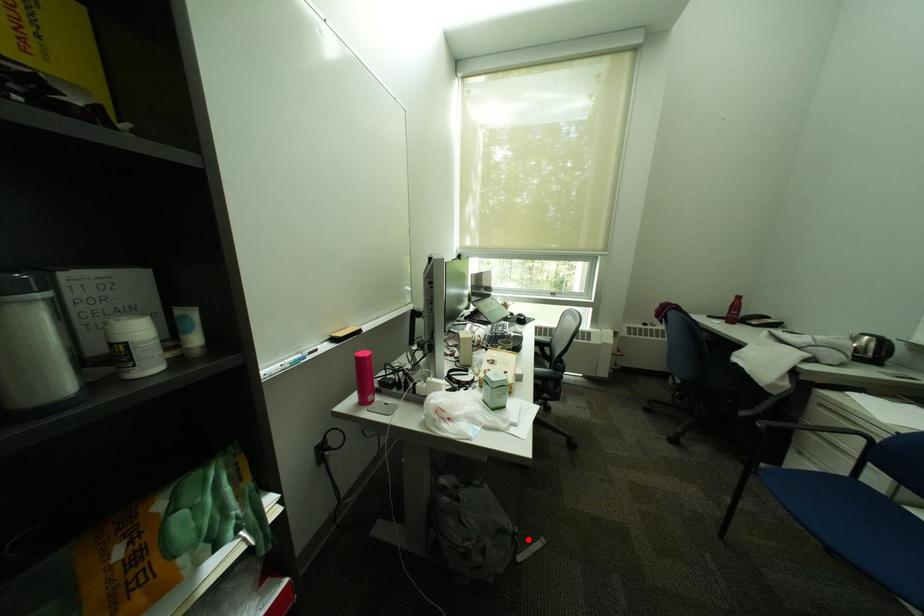
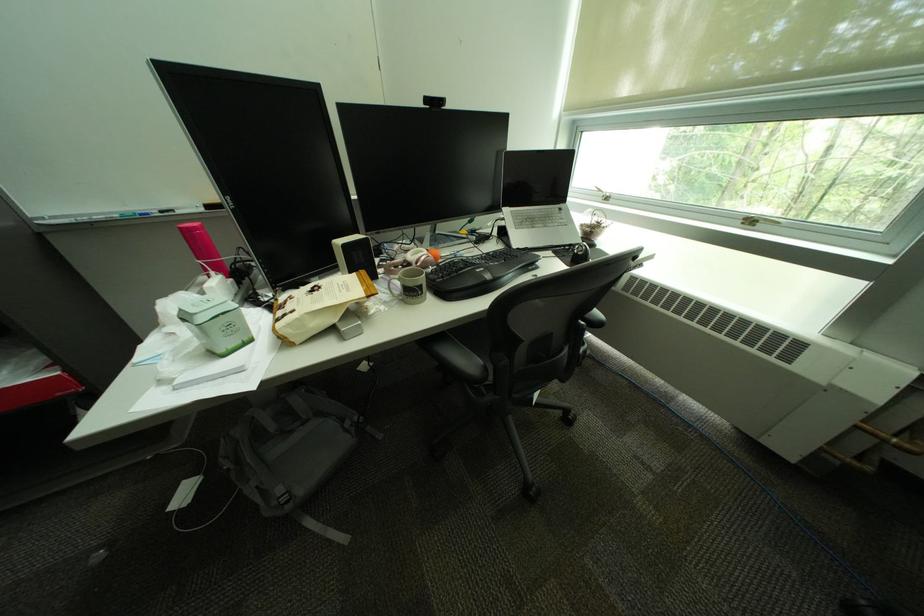
Locate, in the second image, the point that corresponds to the highlighted location in the first image.

(299, 508)